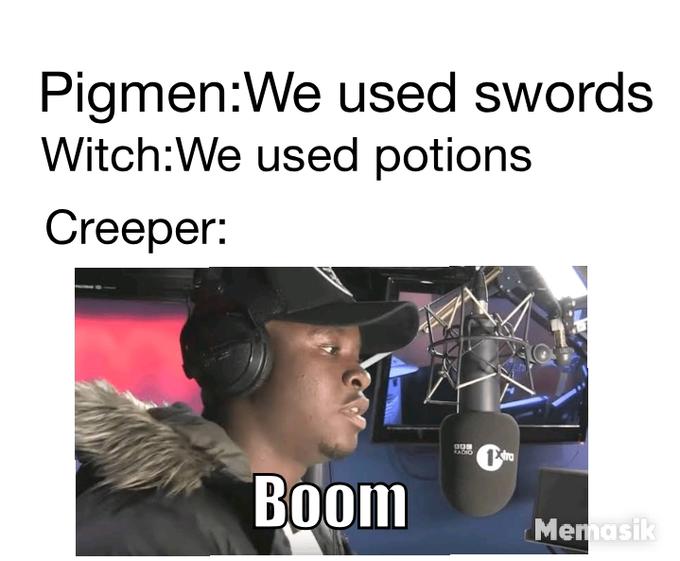
I want to click on wall, so click(x=137, y=339).